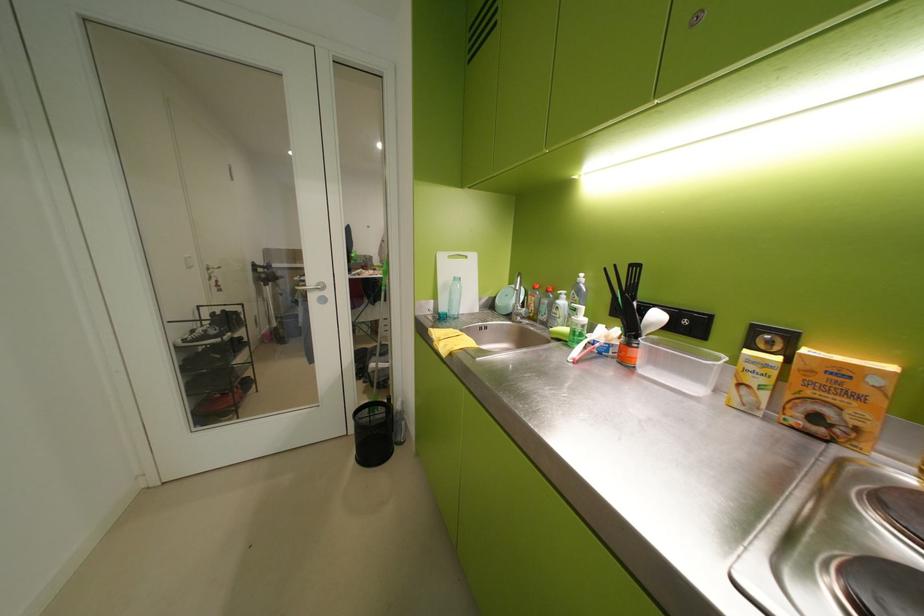
Where would you lift the white cutting board? Please return your answer as a coordinate pair (x, y).

(457, 278)